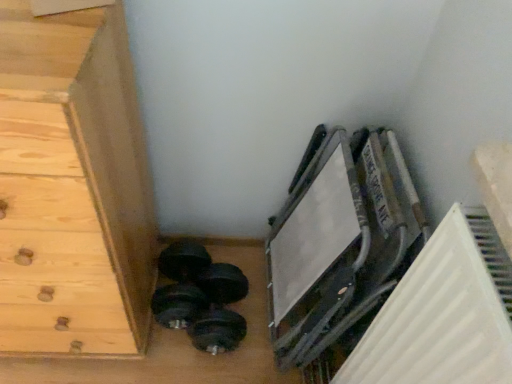
Question: Visually, is light wood chest of drawers at lower left positioned to the left or to the right of black rubber dumbbell at lower left?

Choices:
 (A) left
 (B) right

Answer: (A)

Question: From a real-world perspective, is light wood chest of drawers at lower left physically located above or below black rubber dumbbell at lower left?

Choices:
 (A) above
 (B) below

Answer: (A)

Question: From their relative heights in the image, would you say light wood chest of drawers at lower left is taller or shorter than black rubber dumbbell at lower left?

Choices:
 (A) tall
 (B) short

Answer: (A)

Question: From a real-world perspective, relative to light wood chest of drawers at lower left, is black rubber dumbbell at lower left vertically above or below?

Choices:
 (A) above
 (B) below

Answer: (B)

Question: From the image's perspective, is black rubber dumbbell at lower left positioned above or below light wood chest of drawers at lower left?

Choices:
 (A) below
 (B) above

Answer: (A)

Question: Is black rubber dumbbell at lower left taller or shorter than light wood chest of drawers at lower left?

Choices:
 (A) short
 (B) tall

Answer: (A)

Question: Is black rubber dumbbell at lower left situated inside light wood chest of drawers at lower left or outside?

Choices:
 (A) outside
 (B) inside

Answer: (A)